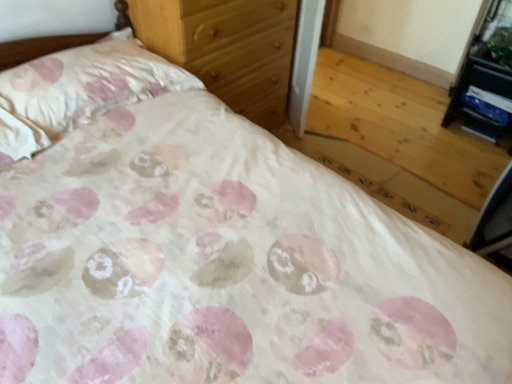
Question: Is the position of wooden chest of drawers at upper center more distant than that of black plastic vanity at upper right?

Choices:
 (A) yes
 (B) no

Answer: (B)

Question: Would you say wooden chest of drawers at upper center is outside black plastic vanity at upper right?

Choices:
 (A) yes
 (B) no

Answer: (A)

Question: Does wooden chest of drawers at upper center have a greater height compared to black plastic vanity at upper right?

Choices:
 (A) no
 (B) yes

Answer: (B)

Question: Is wooden chest of drawers at upper center at the right side of black plastic vanity at upper right?

Choices:
 (A) no
 (B) yes

Answer: (A)

Question: Is wooden chest of drawers at upper center positioned with its back to black plastic vanity at upper right?

Choices:
 (A) no
 (B) yes

Answer: (A)

Question: Is pink satin pillow at upper left inside the boundaries of black plastic vanity at upper right, or outside?

Choices:
 (A) outside
 (B) inside

Answer: (A)

Question: From the image's perspective, is pink satin pillow at upper left located above or below black plastic vanity at upper right?

Choices:
 (A) below
 (B) above

Answer: (A)

Question: Based on their sizes in the image, would you say pink satin pillow at upper left is bigger or smaller than black plastic vanity at upper right?

Choices:
 (A) big
 (B) small

Answer: (A)

Question: Considering the positions of pink satin pillow at upper left and black plastic vanity at upper right in the image, is pink satin pillow at upper left taller or shorter than black plastic vanity at upper right?

Choices:
 (A) tall
 (B) short

Answer: (B)

Question: From the image's perspective, is pink satin pillow at upper left above or below wooden chest of drawers at upper center?

Choices:
 (A) above
 (B) below

Answer: (B)

Question: Is pink satin pillow at upper left taller or shorter than wooden chest of drawers at upper center?

Choices:
 (A) short
 (B) tall

Answer: (A)

Question: In the image, is pink satin pillow at upper left on the left side or the right side of wooden chest of drawers at upper center?

Choices:
 (A) right
 (B) left

Answer: (B)

Question: In the image, is pink satin pillow at upper left positioned in front of or behind wooden chest of drawers at upper center?

Choices:
 (A) front
 (B) behind

Answer: (A)

Question: Does point (221, 74) appear closer or farther from the camera than point (494, 125)?

Choices:
 (A) farther
 (B) closer

Answer: (B)

Question: Would you say wooden chest of drawers at upper center is inside or outside black plastic vanity at upper right?

Choices:
 (A) inside
 (B) outside

Answer: (B)